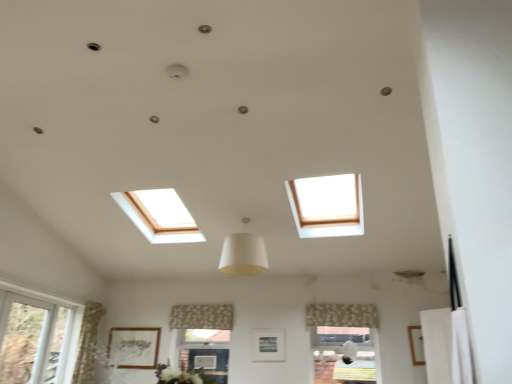
Question: Choose the correct answer: Is wooden picture frame at lower right, which is the first picture frame from right to left, inside floral fabric curtain at center, acting as the 2th curtain starting from the right, or outside it?

Choices:
 (A) inside
 (B) outside

Answer: (B)

Question: From the image's perspective, is wooden picture frame at lower right, the first picture frame viewed from the front, above or below floral fabric curtain at center, which is counted as the 1th curtain, starting from the back?

Choices:
 (A) above
 (B) below

Answer: (B)

Question: Which object is positioned closest to the patterned fabric curtain at lower center, which appears as the 1th curtain when viewed from the right?

Choices:
 (A) floral fabric curtain at center, which is counted as the 1th curtain, starting from the left
 (B) white plastic window at lower left
 (C) wooden picture frame at lower right, the first picture frame viewed from the front
 (D) matte silver picture frame at center, arranged as the second picture frame when viewed from the left
 (E) matte white picture frame at lower center, the 1th picture frame viewed from the back

Answer: (D)

Question: Which of these objects is positioned farthest from the matte silver picture frame at center, which is the 2th picture frame in front-to-back order?

Choices:
 (A) white plastic window at lower left
 (B) patterned fabric curtain at lower center, the first curtain when ordered from front to back
 (C) wooden picture frame at lower right, the first picture frame viewed from the front
 (D) matte white picture frame at lower center, the 1th picture frame viewed from the back
 (E) floral fabric curtain at center, arranged as the 2th curtain when viewed from the front

Answer: (A)